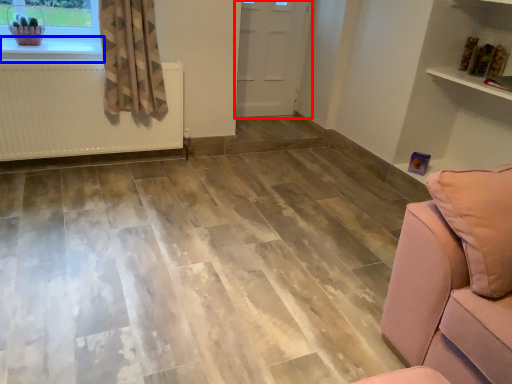
Question: Which object appears closest to the camera in this image, door (highlighted by a red box) or window sill (highlighted by a blue box)?

Choices:
 (A) door
 (B) window sill

Answer: (B)